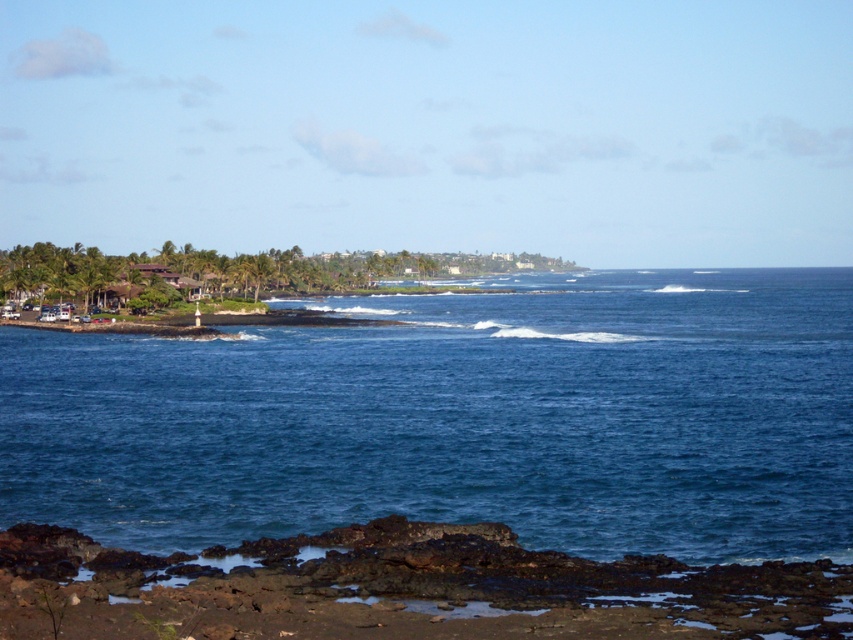
Question: Can you confirm if blue water at center is positioned to the right of rusty rock at lower left?

Choices:
 (A) yes
 (B) no

Answer: (A)

Question: Can you confirm if blue water at center is positioned above rusty rock at lower left?

Choices:
 (A) no
 (B) yes

Answer: (B)

Question: Which point is closer to the camera?

Choices:
 (A) (492, 304)
 (B) (689, 592)

Answer: (B)

Question: Does blue water at center have a larger size compared to rusty rock at lower left?

Choices:
 (A) yes
 (B) no

Answer: (A)

Question: Among these objects, which one is nearest to the camera?

Choices:
 (A) rusty rock at lower left
 (B) blue water at center

Answer: (A)